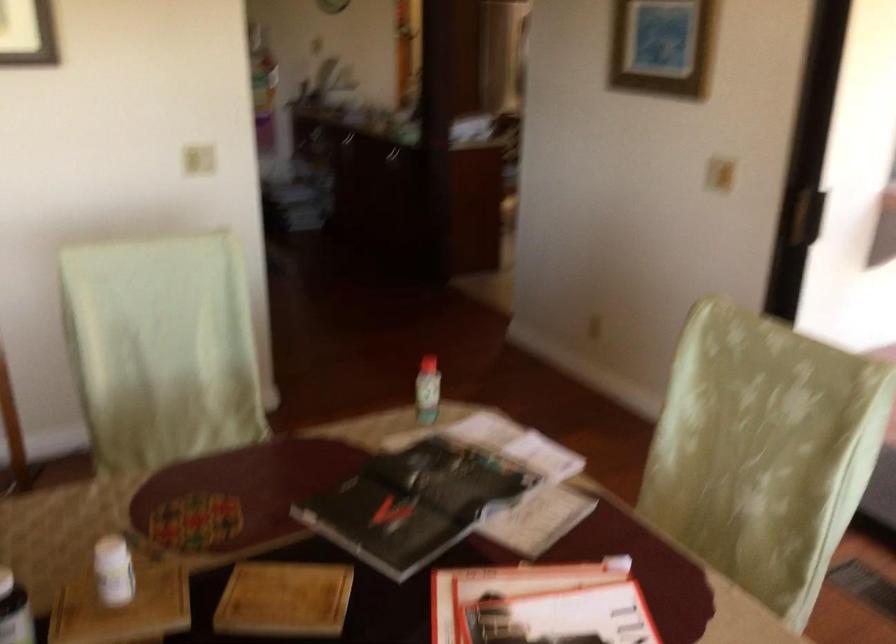
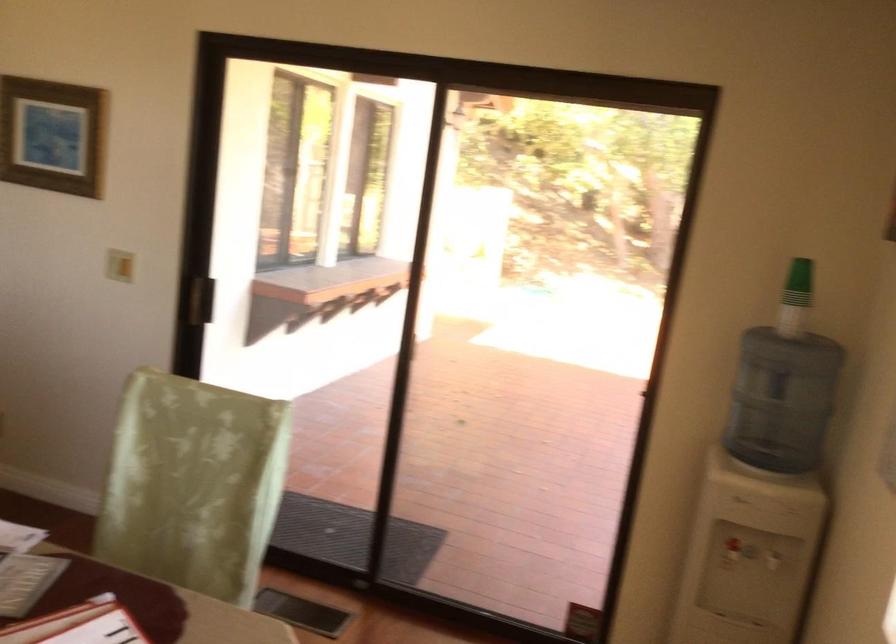
In the second image, find the point that corresponds to point 714,527 in the first image.

(168, 565)